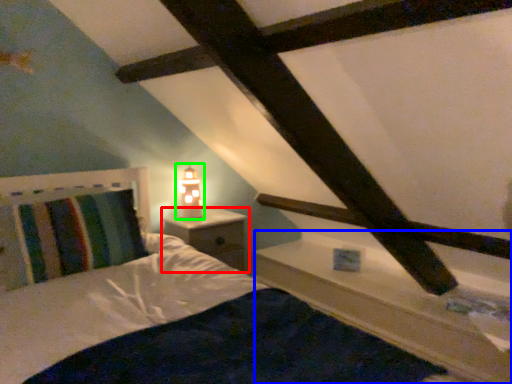
Question: Considering the real-world distances, which object is closest to nightstand (highlighted by a red box)? ledge (highlighted by a blue box) or table lamp (highlighted by a green box).

Choices:
 (A) ledge
 (B) table lamp

Answer: (B)